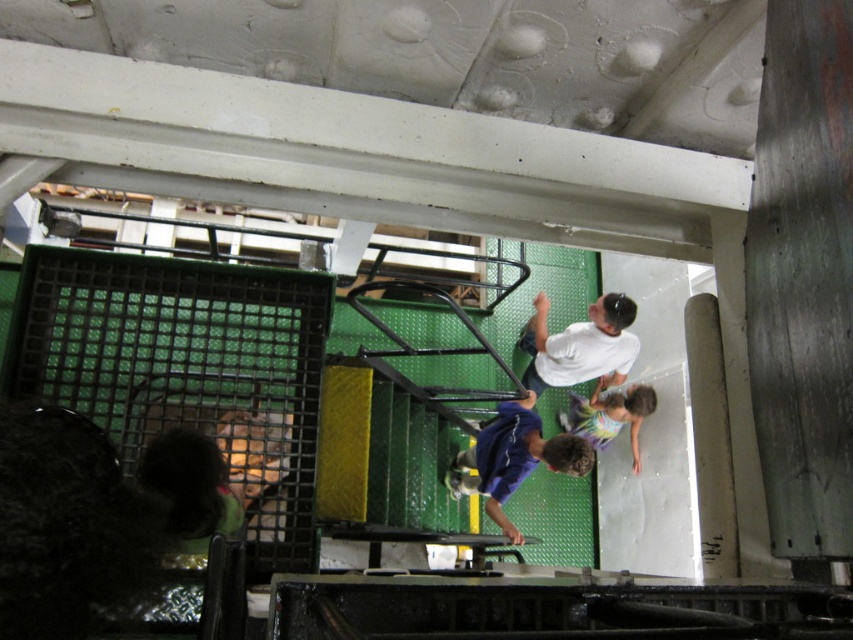
Question: Among these points, which one is nearest to the camera?

Choices:
 (A) (523, 339)
 (B) (605, 394)

Answer: (B)

Question: Which object is farther from the camera taking this photo?

Choices:
 (A) white matte shirt at upper center
 (B) multicolored striped swimsuit at center

Answer: (B)

Question: In this image, where is blue matte skateboard at center located relative to multicolored striped swimsuit at center?

Choices:
 (A) right
 (B) left

Answer: (B)

Question: Can you confirm if white matte shirt at upper center is positioned to the right of multicolored striped swimsuit at center?

Choices:
 (A) no
 (B) yes

Answer: (A)

Question: Which point is closer to the camera?

Choices:
 (A) (558, 337)
 (B) (480, 428)
 (C) (590, 404)

Answer: (B)

Question: Is blue matte skateboard at center in front of multicolored striped swimsuit at center?

Choices:
 (A) no
 (B) yes

Answer: (B)